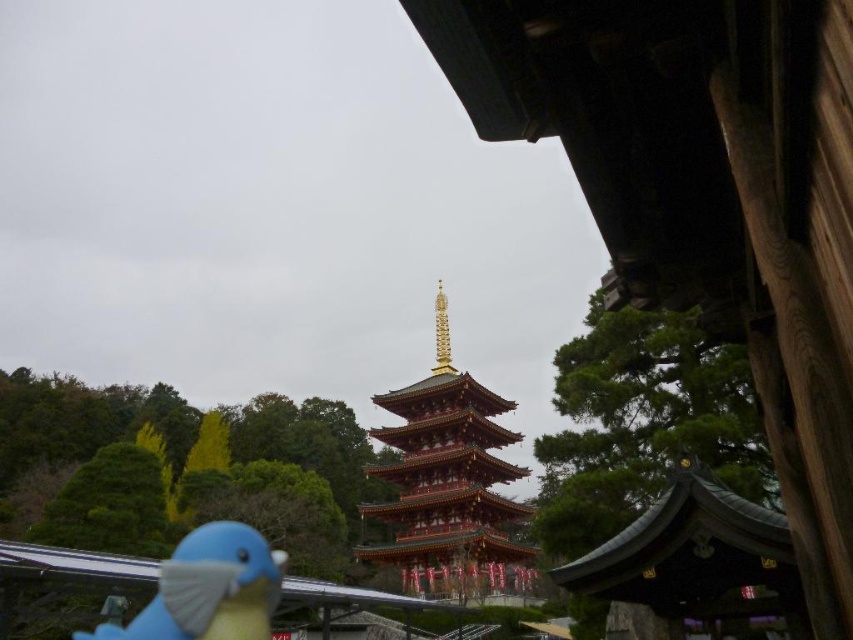
Question: Is red lacquered pagoda at center wider than blue matte parrot at lower left?

Choices:
 (A) yes
 (B) no

Answer: (B)

Question: Does red lacquered pagoda at center appear over blue matte parrot at lower left?

Choices:
 (A) yes
 (B) no

Answer: (A)

Question: In this image, where is red lacquered pagoda at center located relative to blue matte parrot at lower left?

Choices:
 (A) below
 (B) above

Answer: (B)

Question: Which point is closer to the camera taking this photo?

Choices:
 (A) (196, 576)
 (B) (502, 582)

Answer: (A)